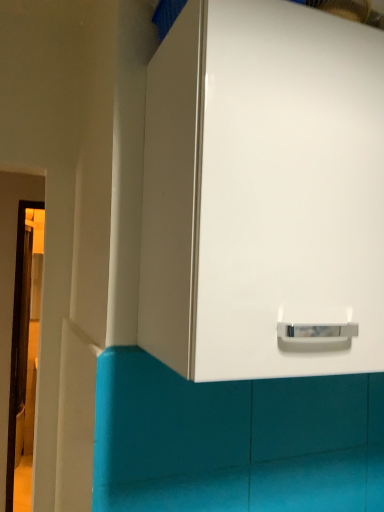
The width and height of the screenshot is (384, 512). I want to click on white glossy cabinet at center, so click(x=262, y=190).

Describe the element at coordinates (262, 190) in the screenshot. Image resolution: width=384 pixels, height=512 pixels. I see `white glossy cabinet at center` at that location.

You are a GUI agent. You are given a task and a screenshot of the screen. Output one action in this format:
    pyautogui.click(x=<x>, y=<y>)
    Task: Click on the white glossy cabinet at center
    The image size is (384, 512).
    Given the screenshot: What is the action you would take?
    pyautogui.click(x=262, y=190)